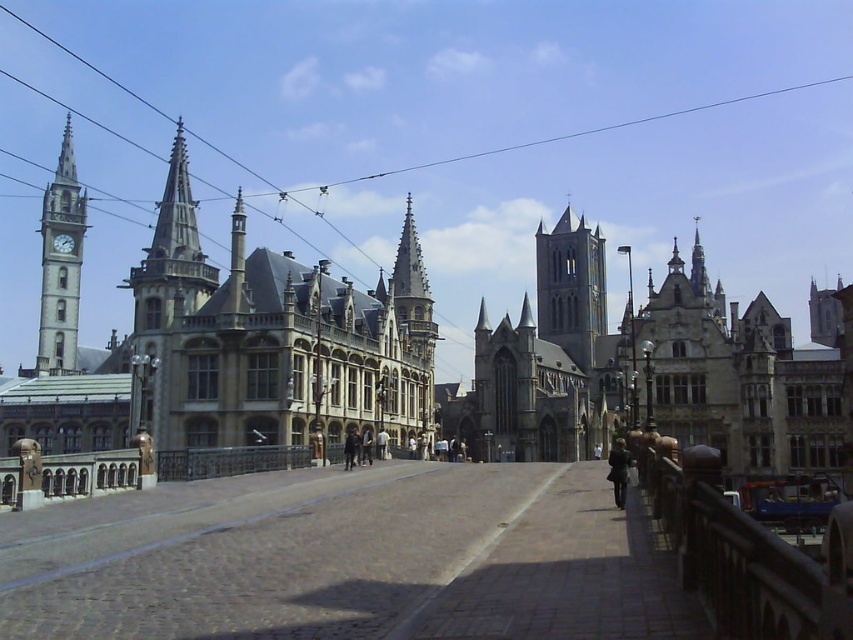
In the scene shown: Does black wire at upper center appear on the right side of smooth gray spire at center?

Indeed, black wire at upper center is positioned on the right side of smooth gray spire at center.

Does black wire at upper center lie in front of smooth gray spire at center?

Yes.

The height and width of the screenshot is (640, 853). What are the coordinates of `black wire at upper center` in the screenshot? It's located at coord(437,138).

Is smooth gray stone tower at center positioned before matte gray clock tower at left?

No, smooth gray stone tower at center is further to the viewer.

Can you confirm if smooth gray stone tower at center is positioned to the left of matte gray clock tower at left?

In fact, smooth gray stone tower at center is to the right of matte gray clock tower at left.

Does point (575, 248) come farther from viewer compared to point (48, 262)?

Yes, point (575, 248) is farther from viewer.

This screenshot has width=853, height=640. Find the location of `smooth gray stone tower at center`. smooth gray stone tower at center is located at coordinates [x=572, y=288].

From the picture: Is black wire at upper center wider than matte gray clock tower at left?

Indeed, black wire at upper center has a greater width compared to matte gray clock tower at left.

I want to click on black wire at upper center, so click(437, 138).